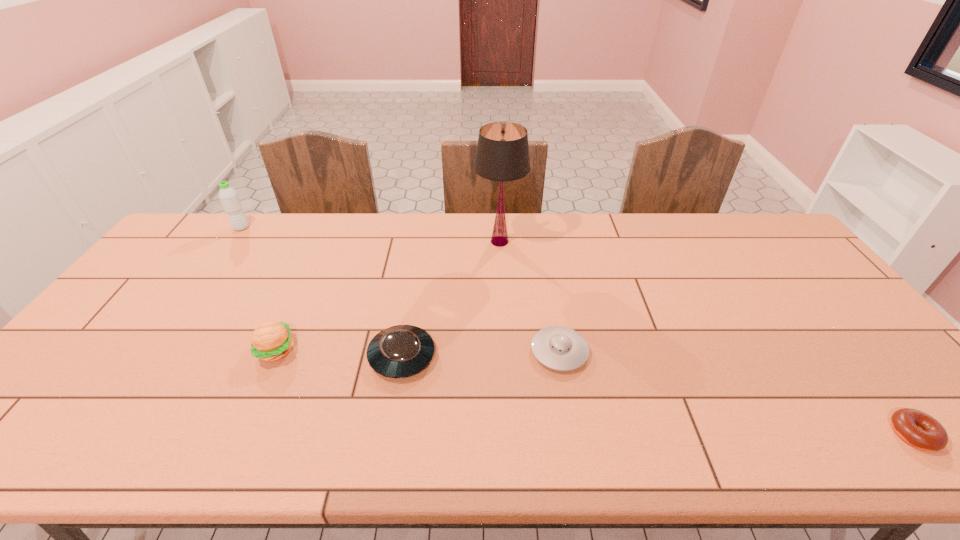
I want to click on the tallest object, so click(502, 154).

Where is `the fifth shortest object`? This screenshot has width=960, height=540. the fifth shortest object is located at coordinates tap(228, 196).

Find the location of a particular element. The width and height of the screenshot is (960, 540). water bottle is located at coordinates (228, 196).

In order to click on the second object from left to right in this screenshot , I will do `click(271, 341)`.

The height and width of the screenshot is (540, 960). What are the coordinates of `the third tallest object` in the screenshot? It's located at (271, 341).

Where is `the left saucer`? The width and height of the screenshot is (960, 540). the left saucer is located at coordinates (400, 351).

Locate an element on the screen. Image resolution: width=960 pixels, height=540 pixels. the fourth object from right to left is located at coordinates (400, 351).

The width and height of the screenshot is (960, 540). I want to click on the shorter saucer, so click(x=559, y=348).

Image resolution: width=960 pixels, height=540 pixels. What are the coordinates of `the right saucer` in the screenshot? It's located at (559, 348).

Where is `the rightmost object`? the rightmost object is located at coordinates (920, 430).